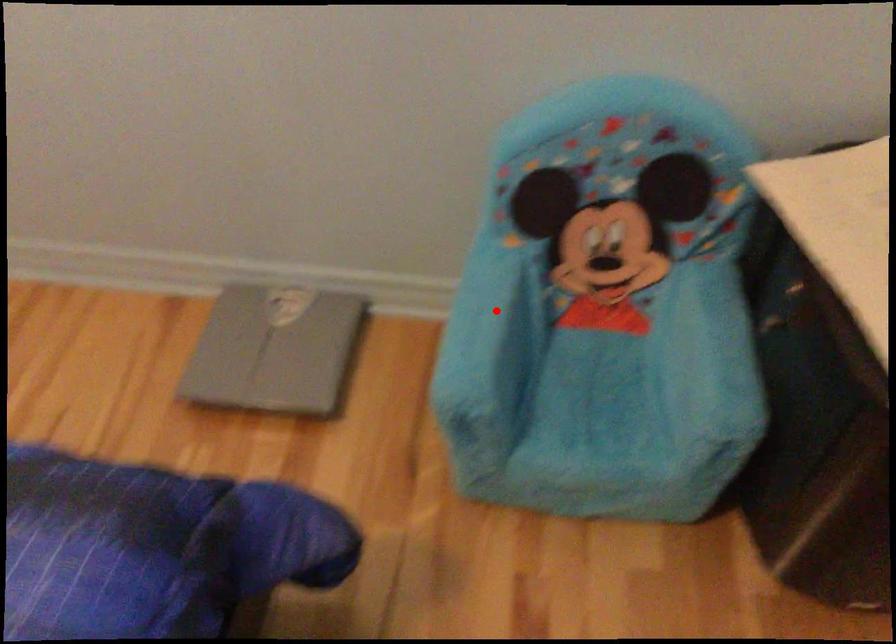
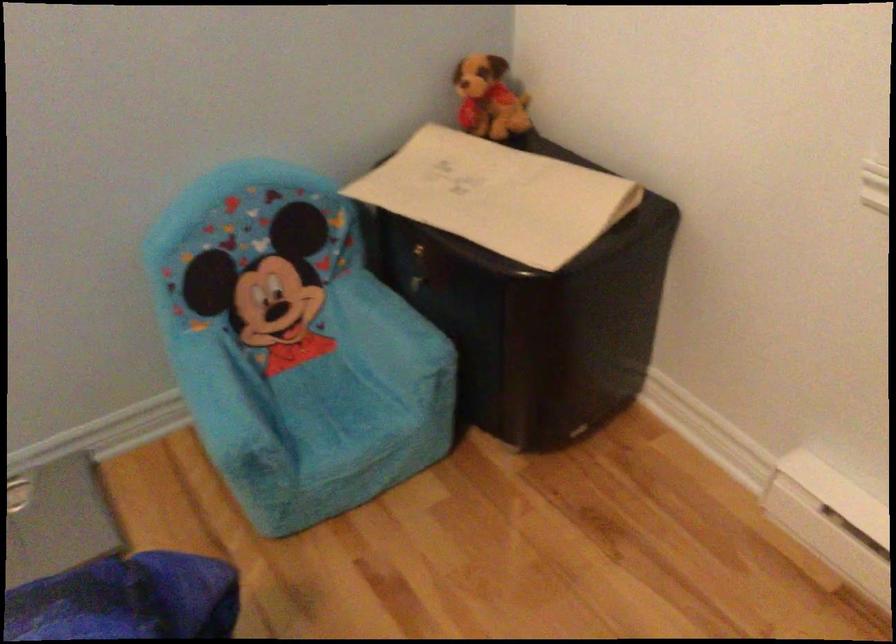
Question: I am providing you with two images of the same scene from different viewpoints. A red point is shown in image1. For the corresponding object point in image2, is it positioned nearer or farther from the camera?

Choices:
 (A) Nearer
 (B) Farther

Answer: (B)